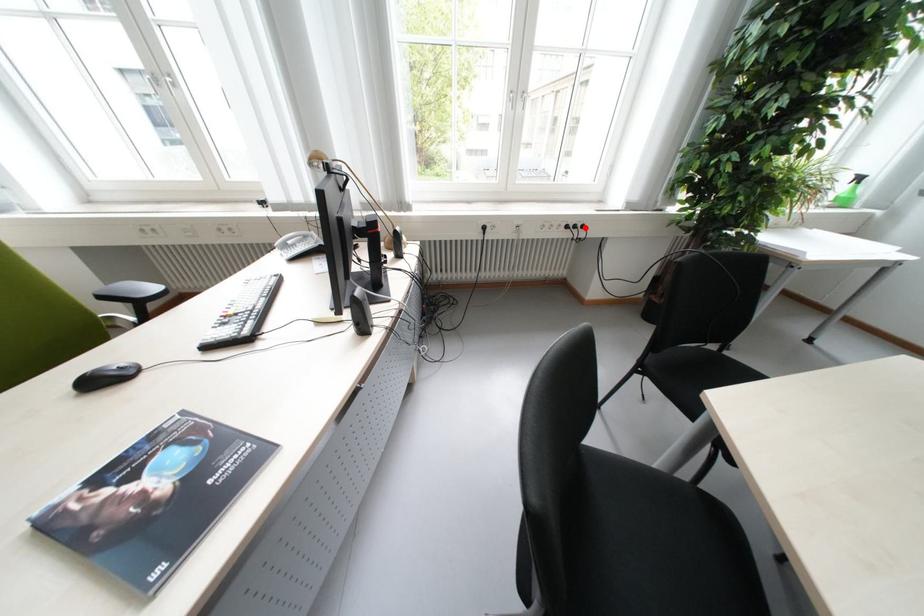
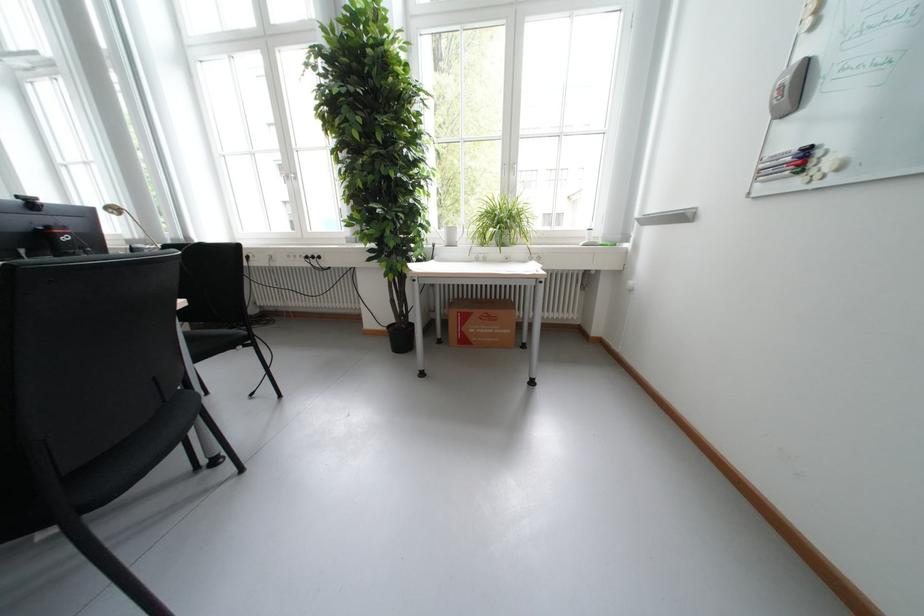
Question: I am providing you with two images of the same scene from different viewpoints. Given a red point in image1, look at the same physical point in image2. Is it:

Choices:
 (A) Closer to the viewpoint
 (B) Farther from the viewpoint

Answer: (B)